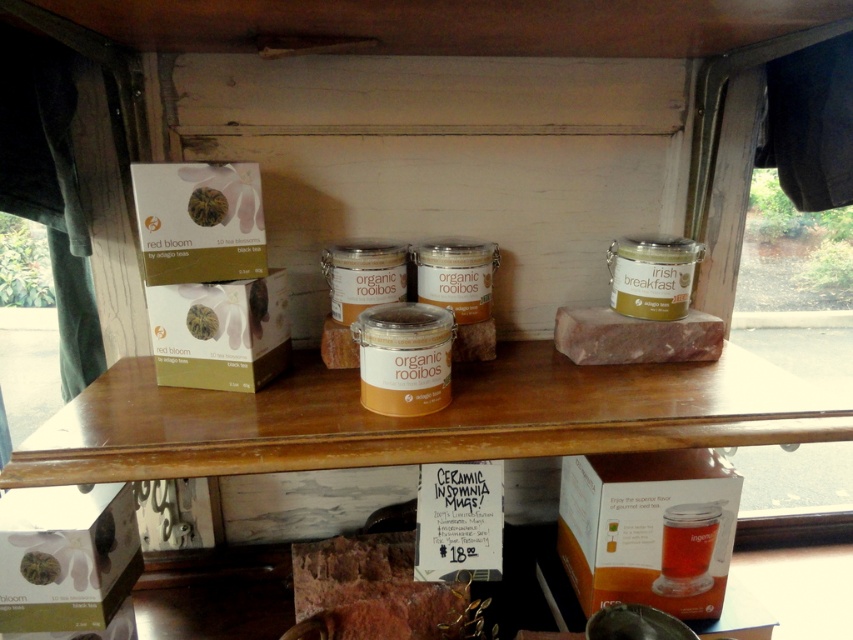
Question: Which object appears farthest from the camera in this image?

Choices:
 (A) matte white box at upper left
 (B) brown textured meat at center

Answer: (B)

Question: Does matte white box at upper left come behind green matte box at center?

Choices:
 (A) no
 (B) yes

Answer: (A)

Question: From the image, what is the correct spatial relationship of matte green cardboard box at lower left in relation to green matte box at center?

Choices:
 (A) above
 (B) below

Answer: (B)

Question: Considering the relative positions of wooden shelf at center and brown textured meat at center in the image provided, where is wooden shelf at center located with respect to brown textured meat at center?

Choices:
 (A) right
 (B) left

Answer: (A)

Question: Which of the following is the farthest from the observer?

Choices:
 (A) matte green cardboard box at lower left
 (B) wooden shelf at center

Answer: (A)

Question: Which object appears farthest from the camera in this image?

Choices:
 (A) matte green cardboard box at lower left
 (B) clear plastic box at lower center
 (C) wooden shelf at center

Answer: (B)